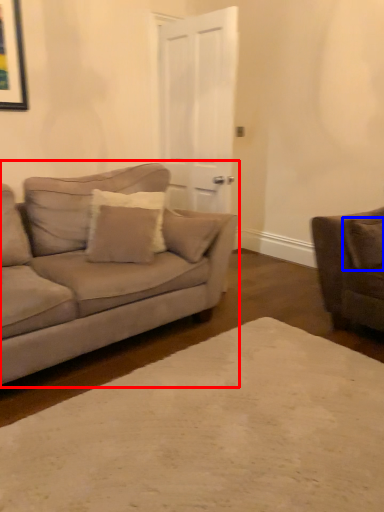
Question: Which point is further to the camera, studio couch (highlighted by a red box) or pillow (highlighted by a blue box)?

Choices:
 (A) studio couch
 (B) pillow

Answer: (B)